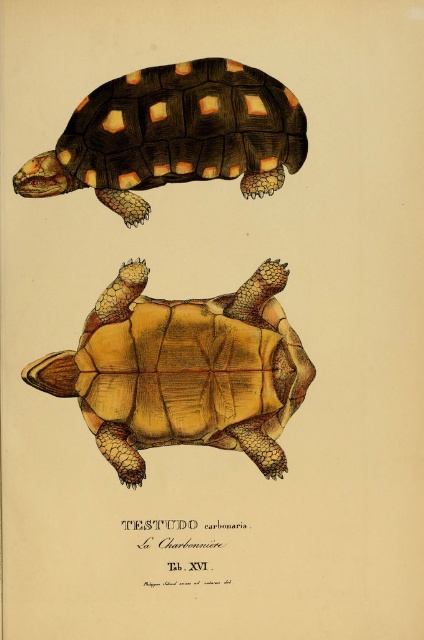
You are an artist studying the turtle illustration. The turtle has a yellow matte shell at center. Where exactly is this shell positioned in the image?

The yellow matte shell at center is located at point (184, 371).

In the botanical illustration of Testudo carbonaria, you see a yellow matte shell at center and a matte orange shell at upper left. Which of these two shells is positioned to the right of the other?

The yellow matte shell at center is positioned to the right of the matte orange shell at upper left.

You are an art conservator examining the turtle illustration. You notice two points marked on the image at coordinates point [284,320] and point [97,129]. Which point is closer to the viewer?

Point [284,320] is further to the camera than point [97,129], so the point closer to the viewer is point [97,129].